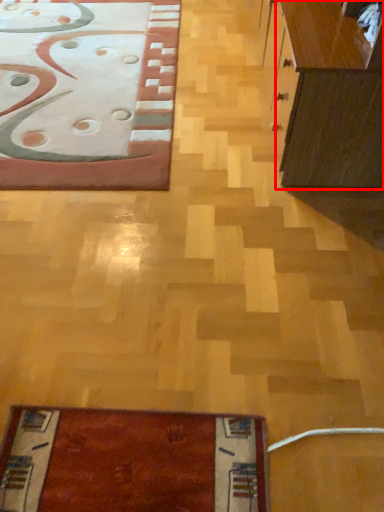
Question: Observing the image, what is the correct spatial positioning of cabinetry (annotated by the red box) in reference to furniture?

Choices:
 (A) left
 (B) right

Answer: (B)